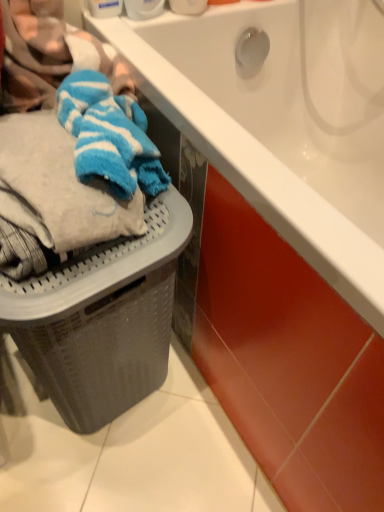
What do you see at coordinates (283, 121) in the screenshot? I see `white glossy bathtub at upper center` at bounding box center [283, 121].

This screenshot has width=384, height=512. What do you see at coordinates (143, 8) in the screenshot?
I see `white plastic container at upper center, the 1th toiletry when ordered from left to right` at bounding box center [143, 8].

Measure the distance between point [134,5] and camera.

Point [134,5] is 31.02 inches from camera.

Where is `blue striped towel at left`? This screenshot has height=512, width=384. blue striped towel at left is located at coordinates (72, 141).

Considering the relative sizes of gray textured laundry basket at lower left and blue striped towel at left in the image provided, is gray textured laundry basket at lower left thinner than blue striped towel at left?

Incorrect, the width of gray textured laundry basket at lower left is not less than that of blue striped towel at left.

Can you confirm if gray textured laundry basket at lower left is smaller than blue striped towel at left?

Actually, gray textured laundry basket at lower left might be larger than blue striped towel at left.

Between point (150, 227) and point (78, 166), which one is positioned behind?

The point (150, 227) is farther from the camera.

From the picture: Based on their positions, is blue striped towel at left located to the left or right of gray textured laundry basket at lower left?

Based on their positions, blue striped towel at left is located to the right of gray textured laundry basket at lower left.

Considering the positions of point (105, 104) and point (137, 243), is point (105, 104) closer or farther from the camera than point (137, 243)?

Point (105, 104) is positioned farther from the camera compared to point (137, 243).

Are blue striped towel at left and gray textured laundry basket at lower left beside each other?

blue striped towel at left and gray textured laundry basket at lower left are not in contact.

Considering the sizes of blue striped towel at left and gray textured laundry basket at lower left in the image, is blue striped towel at left bigger or smaller than gray textured laundry basket at lower left?

In the image, blue striped towel at left appears to be smaller than gray textured laundry basket at lower left.

Where is `toiletry on the left of white plastic container at upper center, which ranks as the 1th toiletry in right-to-left order`? The width and height of the screenshot is (384, 512). toiletry on the left of white plastic container at upper center, which ranks as the 1th toiletry in right-to-left order is located at coordinates (143, 8).

Can you confirm if white plastic container at upper center, which is counted as the 2th toiletry, starting from the left, is shorter than white plastic container at upper center, the 1th toiletry when ordered from left to right?

Incorrect, the height of white plastic container at upper center, which is counted as the 2th toiletry, starting from the left, does not fall short of that of white plastic container at upper center, the 1th toiletry when ordered from left to right.

Is white plastic container at upper center, which ranks as the 1th toiletry in right-to-left order, in front of or behind white plastic container at upper center, the 1th toiletry when ordered from left to right, in the image?

white plastic container at upper center, which ranks as the 1th toiletry in right-to-left order, is positioned closer to the viewer than white plastic container at upper center, the 1th toiletry when ordered from left to right.

Does white plastic container at upper center, which is counted as the 2th toiletry, starting from the left, have a larger size compared to white plastic container at upper center, arranged as the 2th toiletry when viewed from the right?

Yes.

Is white plastic container at upper center, the 1th toiletry when ordered from left to right, in front of or behind white glossy bathtub at upper center in the image?

white plastic container at upper center, the 1th toiletry when ordered from left to right, is positioned farther from the viewer than white glossy bathtub at upper center.

In the scene shown: Is white plastic container at upper center, arranged as the 2th toiletry when viewed from the right, looking in the opposite direction of white glossy bathtub at upper center?

No, white glossy bathtub at upper center is not at the back of white plastic container at upper center, arranged as the 2th toiletry when viewed from the right.

Based on the photo, between white plastic container at upper center, arranged as the 2th toiletry when viewed from the right, and white glossy bathtub at upper center, which one has larger size?

With larger size is white glossy bathtub at upper center.

The width and height of the screenshot is (384, 512). Identify the location of the 2nd toiletry to the left of the white glossy bathtub at upper center, counting from the anchor's position. (143, 8).

From a real-world perspective, which is physically above, gray textured laundry basket at lower left or white plastic container at upper center, which ranks as the 1th toiletry in right-to-left order?

white plastic container at upper center, which ranks as the 1th toiletry in right-to-left order.

Does gray textured laundry basket at lower left appear on the right side of white plastic container at upper center, which is counted as the 2th toiletry, starting from the left?

No.

Which of these two, gray textured laundry basket at lower left or white plastic container at upper center, which is counted as the 2th toiletry, starting from the left, is smaller?

white plastic container at upper center, which is counted as the 2th toiletry, starting from the left, is smaller.

Is white plastic container at upper center, which is counted as the 2th toiletry, starting from the left, located within gray textured laundry basket at lower left?

That's incorrect, white plastic container at upper center, which is counted as the 2th toiletry, starting from the left, is not inside gray textured laundry basket at lower left.

Can you tell me how much white plastic container at upper center, arranged as the 2th toiletry when viewed from the right, and white plastic container at upper center, which is counted as the 2th toiletry, starting from the left, differ in facing direction?

0.000505 degrees separate the facing orientations of white plastic container at upper center, arranged as the 2th toiletry when viewed from the right, and white plastic container at upper center, which is counted as the 2th toiletry, starting from the left.

Could you tell me if white plastic container at upper center, arranged as the 2th toiletry when viewed from the right, is turned towards white plastic container at upper center, which ranks as the 1th toiletry in right-to-left order?

No, white plastic container at upper center, arranged as the 2th toiletry when viewed from the right, is not facing towards white plastic container at upper center, which ranks as the 1th toiletry in right-to-left order.

Which of these two, white plastic container at upper center, the 1th toiletry when ordered from left to right, or white plastic container at upper center, which is counted as the 2th toiletry, starting from the left, is wider?

white plastic container at upper center, which is counted as the 2th toiletry, starting from the left, is wider.

Considering the points (153, 15) and (181, 6), which point is behind, point (153, 15) or point (181, 6)?

Point (181, 6)

Does gray textured laundry basket at lower left touch white plastic container at upper center, the 1th toiletry when ordered from left to right?

No, gray textured laundry basket at lower left is not making contact with white plastic container at upper center, the 1th toiletry when ordered from left to right.

From the picture: Relative to white plastic container at upper center, arranged as the 2th toiletry when viewed from the right, is gray textured laundry basket at lower left in front or behind?

gray textured laundry basket at lower left is positioned closer to the viewer than white plastic container at upper center, arranged as the 2th toiletry when viewed from the right.

Is gray textured laundry basket at lower left situated inside white plastic container at upper center, arranged as the 2th toiletry when viewed from the right, or outside?

gray textured laundry basket at lower left is located beyond the bounds of white plastic container at upper center, arranged as the 2th toiletry when viewed from the right.

The image size is (384, 512). Identify the location of the 1st toiletry above the gray textured laundry basket at lower left (from a real-world perspective). (143, 8).

Identify the location of laundry lying on the right of gray textured laundry basket at lower left. (72, 141).

Locate an element on the screen. This screenshot has height=512, width=384. laundry that appears in front of the gray textured laundry basket at lower left is located at coordinates (x=72, y=141).

Based on the photo, when comparing their distances from blue striped towel at left, does white plastic container at upper center, which is counted as the 2th toiletry, starting from the left, or gray textured laundry basket at lower left seem further?

white plastic container at upper center, which is counted as the 2th toiletry, starting from the left.

Considering their positions, is white plastic container at upper center, which is counted as the 2th toiletry, starting from the left, positioned closer to white glossy bathtub at upper center than gray textured laundry basket at lower left?

white plastic container at upper center, which is counted as the 2th toiletry, starting from the left, is closer to white glossy bathtub at upper center.

Which object lies further to the anchor point gray textured laundry basket at lower left, white plastic container at upper center, the 1th toiletry when ordered from left to right, or blue striped towel at left?

Among the two, white plastic container at upper center, the 1th toiletry when ordered from left to right, is located further to gray textured laundry basket at lower left.

Considering their positions, is blue striped towel at left positioned closer to white glossy bathtub at upper center than gray textured laundry basket at lower left?

blue striped towel at left lies closer to white glossy bathtub at upper center than the other object.

Based on their spatial positions, is blue striped towel at left or white glossy bathtub at upper center closer to white plastic container at upper center, the 1th toiletry when ordered from left to right?

blue striped towel at left.

Which object lies nearer to the anchor point white plastic container at upper center, which ranks as the 1th toiletry in right-to-left order, gray textured laundry basket at lower left or white glossy bathtub at upper center?

Based on the image, white glossy bathtub at upper center appears to be nearer to white plastic container at upper center, which ranks as the 1th toiletry in right-to-left order.

Considering their positions, is blue striped towel at left positioned further to white plastic container at upper center, which ranks as the 1th toiletry in right-to-left order, than white plastic container at upper center, arranged as the 2th toiletry when viewed from the right?

blue striped towel at left.

When comparing their distances from gray textured laundry basket at lower left, does white glossy bathtub at upper center or blue striped towel at left seem further?

white glossy bathtub at upper center lies further to gray textured laundry basket at lower left than the other object.

What are the coordinates of `laundry situated between gray textured laundry basket at lower left and white glossy bathtub at upper center from left to right` in the screenshot? It's located at (72, 141).

Locate an element on the screen. The height and width of the screenshot is (512, 384). bathtub that lies between white plastic container at upper center, the 1th toiletry when ordered from left to right, and gray textured laundry basket at lower left from top to bottom is located at coordinates (283, 121).

You are a GUI agent. You are given a task and a screenshot of the screen. Output one action in this format:
    pyautogui.click(x=<x>, y=<y>)
    Task: Click on the laundry between white plastic container at upper center, arranged as the 2th toiletry when viewed from the right, and gray textured laundry basket at lower left from top to bottom
    The height and width of the screenshot is (512, 384).
    Given the screenshot: What is the action you would take?
    pyautogui.click(x=72, y=141)

I want to click on toiletry between white plastic container at upper center, which ranks as the 1th toiletry in right-to-left order, and white glossy bathtub at upper center from top to bottom, so click(x=143, y=8).